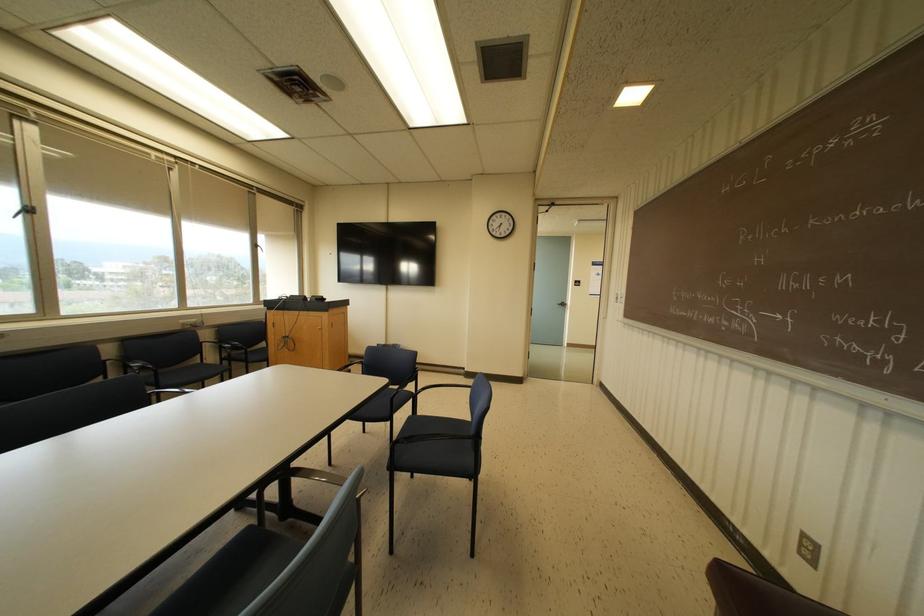
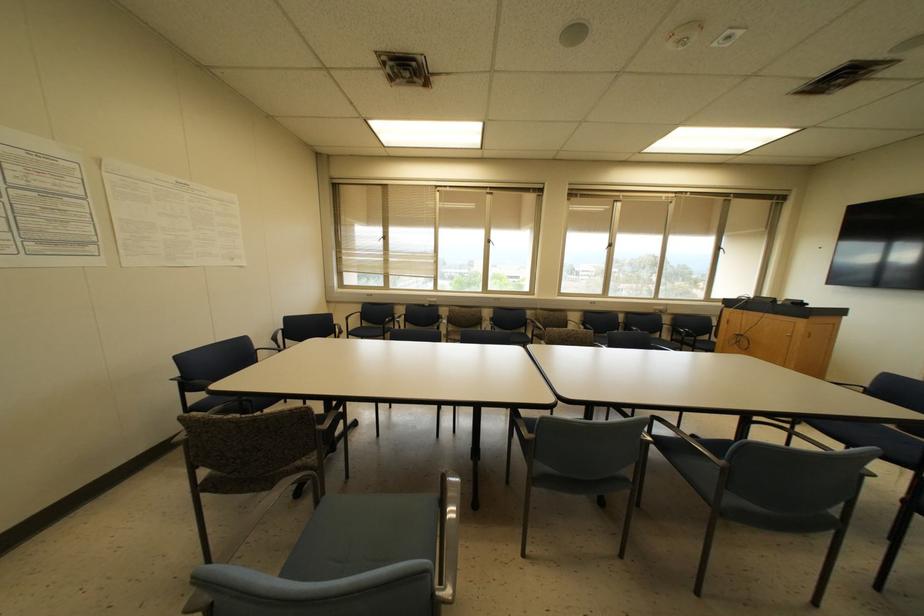
Question: The first image is from the beginning of the video and the second image is from the end. How did the camera likely rotate when shooting the video?

Choices:
 (A) Left
 (B) Right
 (C) Up
 (D) Down

Answer: (A)